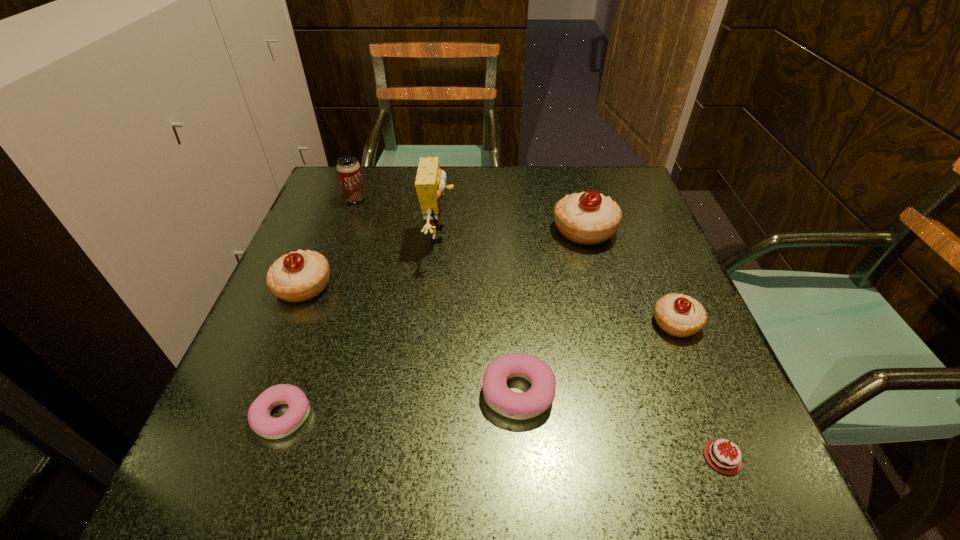
Identify which beige pastry is the closest to the smallest beige pastry. Please provide its 2D coordinates. Your answer should be formatted as a tuple, i.e. [(x, y)], where the tuple contains the x and y coordinates of a point satisfying the conditions above.

[(588, 218)]

Locate an element on the screen. The width and height of the screenshot is (960, 540). beige pastry that is the third closest to the red beer can is located at coordinates (679, 315).

This screenshot has width=960, height=540. Identify the location of free location that satisfies the following two spatial constraints: 1. on the back side of the chocolate cake; 2. on the face of the tallest object. (634, 235).

Locate an element on the screen. Image resolution: width=960 pixels, height=540 pixels. vacant position in the image that satisfies the following two spatial constraints: 1. on the front side of the beer can; 2. on the right side of the rightmost pastry is located at coordinates (311, 323).

At what (x,y) coordinates should I click in order to perform the action: click on vacant space that satisfies the following two spatial constraints: 1. on the face of the sponge; 2. on the left side of the chocolate cake. Please return your answer as a coordinate pair (x, y). Image resolution: width=960 pixels, height=540 pixels. Looking at the image, I should click on (418, 457).

Find the location of a particular element. Image resolution: width=960 pixels, height=540 pixels. free location that satisfies the following two spatial constraints: 1. on the face of the fourth object from right to left; 2. on the right side of the fourth object from left to right is located at coordinates (424, 392).

In order to click on free space that satisfies the following two spatial constraints: 1. on the front side of the shortest object; 2. on the right side of the second shortest object in this screenshot , I will do `click(268, 457)`.

I want to click on vacant space that satisfies the following two spatial constraints: 1. on the front side of the shortest object; 2. on the right side of the third shortest object, so click(x=523, y=457).

You are a GUI agent. You are given a task and a screenshot of the screen. Output one action in this format:
    pyautogui.click(x=<x>, y=<y>)
    Task: Click on the blank area in the image that satisfies the following two spatial constraints: 1. on the front side of the smaller pink pastry; 2. on the right side of the leftmost beige pastry
    The height and width of the screenshot is (540, 960).
    Given the screenshot: What is the action you would take?
    pyautogui.click(x=251, y=416)